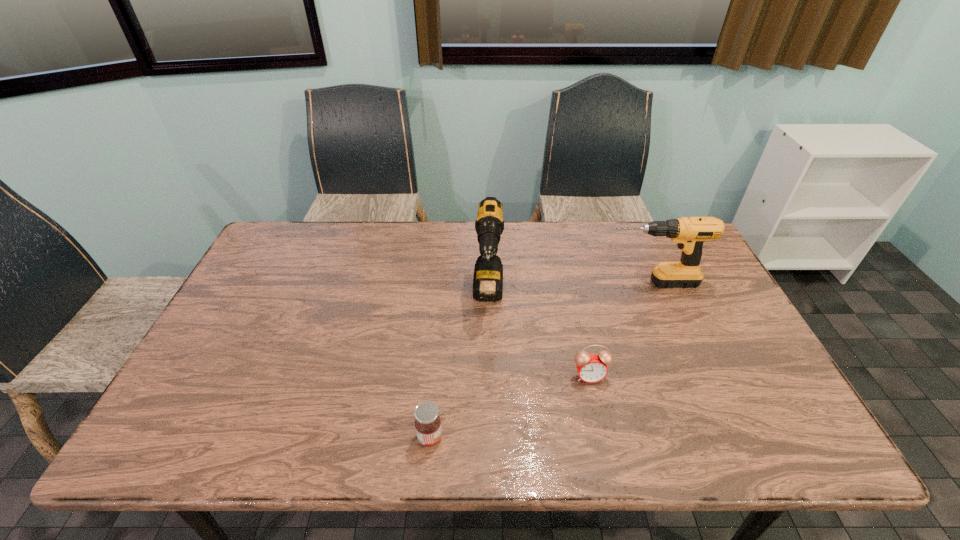
The image size is (960, 540). I want to click on vacant space that satisfies the following two spatial constraints: 1. on the clock face of the second nearest object; 2. on the label side of the nearest object, so click(603, 437).

At what (x,y) coordinates should I click in order to perform the action: click on free spot that satisfies the following two spatial constraints: 1. at the tip of the right drill; 2. on the clock face of the alarm clock. Please return your answer as a coordinate pair (x, y). Looking at the image, I should click on (689, 376).